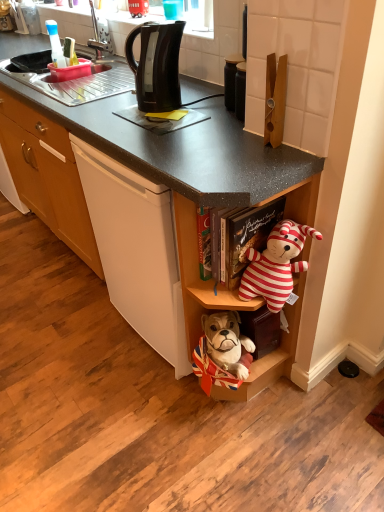
Where is `free space to the left of black plastic kettle at center`? This screenshot has height=512, width=384. free space to the left of black plastic kettle at center is located at coordinates coord(80,334).